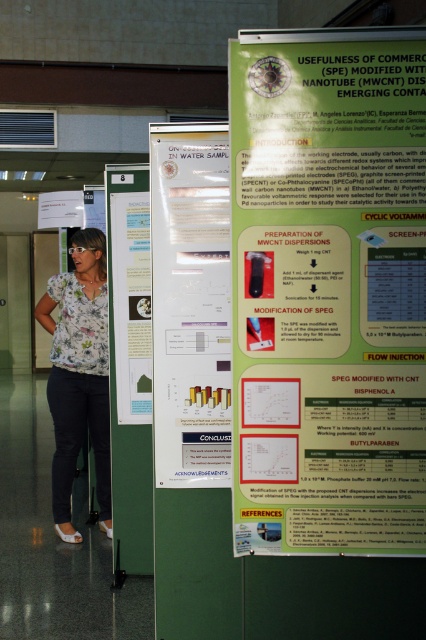
Question: Can you confirm if matte green poster at center is smaller than white paper at center?

Choices:
 (A) no
 (B) yes

Answer: (A)

Question: Which point appears closest to the camera in this image?

Choices:
 (A) (x=273, y=44)
 (B) (x=132, y=170)
 (C) (x=169, y=470)
 (D) (x=48, y=284)

Answer: (A)

Question: Which point appears farthest from the camera in this image?

Choices:
 (A) (89, 288)
 (B) (141, 166)
 (C) (181, 380)

Answer: (A)

Question: From the image, what is the correct spatial relationship of matte green poster at center in relation to white paper at center?

Choices:
 (A) below
 (B) above

Answer: (B)

Question: Which object is farther from the camera taking this photo?

Choices:
 (A) white paper at left
 (B) matte green poster at center
 (C) white paper at center

Answer: (A)

Question: Is white paper at center in front of white paper at left?

Choices:
 (A) no
 (B) yes

Answer: (B)